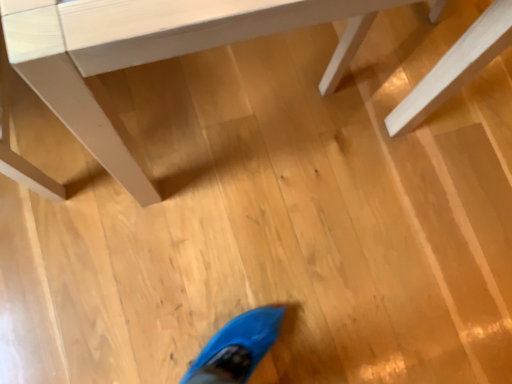
Question: Should I look upward or downward to see white matte table at upper center?

Choices:
 (A) up
 (B) down

Answer: (A)